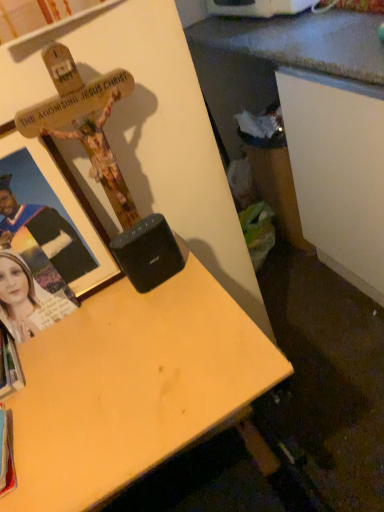
Question: Considering the relative positions of black plastic speaker at center and wooden cross at upper left in the image provided, is black plastic speaker at center to the right of wooden cross at upper left from the viewer's perspective?

Choices:
 (A) yes
 (B) no

Answer: (A)

Question: Is black plastic speaker at center thinner than wooden cross at upper left?

Choices:
 (A) yes
 (B) no

Answer: (A)

Question: From a real-world perspective, is black plastic speaker at center beneath wooden cross at upper left?

Choices:
 (A) no
 (B) yes

Answer: (B)

Question: Would you say black plastic speaker at center contains wooden cross at upper left?

Choices:
 (A) yes
 (B) no

Answer: (B)

Question: Is black plastic speaker at center facing towards wooden cross at upper left?

Choices:
 (A) yes
 (B) no

Answer: (B)

Question: Considering the relative positions of black plastic speaker at center and wooden cross at upper left in the image provided, is black plastic speaker at center to the left of wooden cross at upper left from the viewer's perspective?

Choices:
 (A) yes
 (B) no

Answer: (B)

Question: Considering the relative positions of wooden cross at upper left and white paper book at lower left in the image provided, is wooden cross at upper left behind white paper book at lower left?

Choices:
 (A) yes
 (B) no

Answer: (B)

Question: Can you confirm if wooden cross at upper left is positioned to the left of white paper book at lower left?

Choices:
 (A) no
 (B) yes

Answer: (A)

Question: Is wooden cross at upper left aimed at white paper book at lower left?

Choices:
 (A) yes
 (B) no

Answer: (B)

Question: Considering the relative sizes of wooden cross at upper left and white paper book at lower left in the image provided, is wooden cross at upper left thinner than white paper book at lower left?

Choices:
 (A) no
 (B) yes

Answer: (B)

Question: Can you confirm if wooden cross at upper left is shorter than white paper book at lower left?

Choices:
 (A) no
 (B) yes

Answer: (A)

Question: Is wooden cross at upper left outside white paper book at lower left?

Choices:
 (A) yes
 (B) no

Answer: (A)

Question: From a real-world perspective, is black plastic speaker at center located higher than matte black photo frame at left?

Choices:
 (A) no
 (B) yes

Answer: (A)